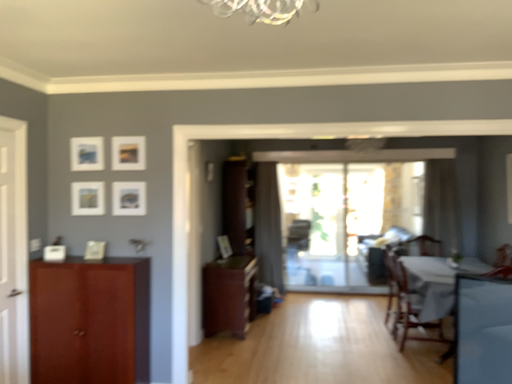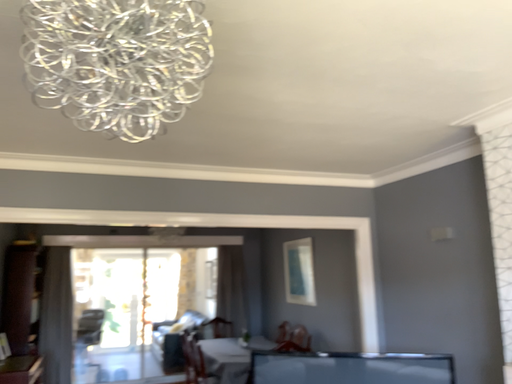
Question: How did the camera likely rotate when shooting the video?

Choices:
 (A) rotated upward
 (B) rotated downward

Answer: (A)